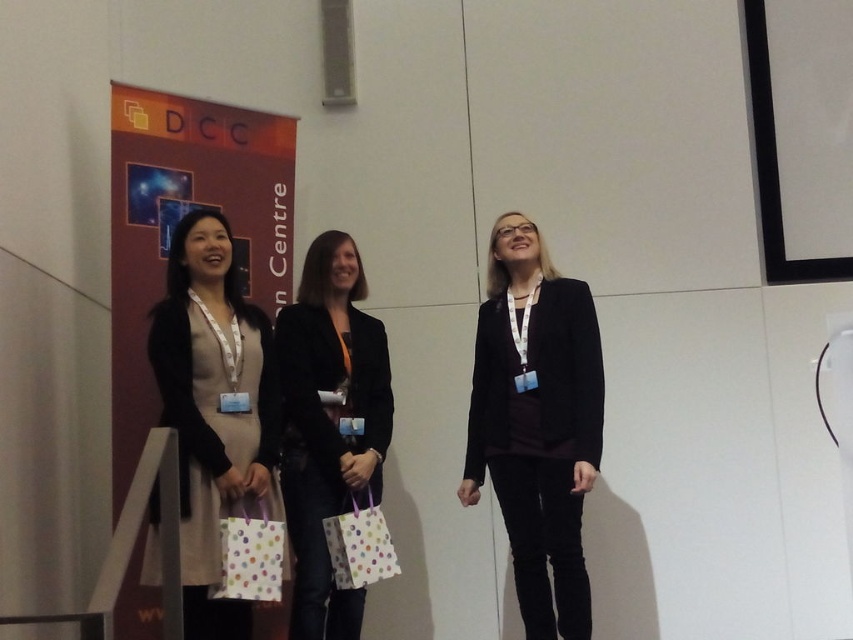
Between matte black blazer at center and white dotted paper bag at center, which one appears on the right side from the viewer's perspective?

matte black blazer at center is more to the right.

Is matte black blazer at center below white dotted paper bag at center?

No.

The width and height of the screenshot is (853, 640). What do you see at coordinates (537, 422) in the screenshot?
I see `matte black blazer at center` at bounding box center [537, 422].

Where is `matte black blazer at center`? matte black blazer at center is located at coordinates (537, 422).

Can you confirm if beige fabric dress at left is smaller than polka dot paper bag at center?

Incorrect, beige fabric dress at left is not smaller in size than polka dot paper bag at center.

Does point (260, 348) come in front of point (260, 580)?

No, (260, 348) is behind (260, 580).

The height and width of the screenshot is (640, 853). In order to click on beige fabric dress at left in this screenshot , I will do `click(213, 410)`.

Is matte black blazer at center to the left of beige fabric dress at left from the viewer's perspective?

No, matte black blazer at center is not to the left of beige fabric dress at left.

Between matte black blazer at center and beige fabric dress at left, which one has more height?

With more height is matte black blazer at center.

Find the location of `matte black blazer at center`. matte black blazer at center is located at coordinates (537, 422).

Find the location of a particular element. The image size is (853, 640). matte black blazer at center is located at coordinates (537, 422).